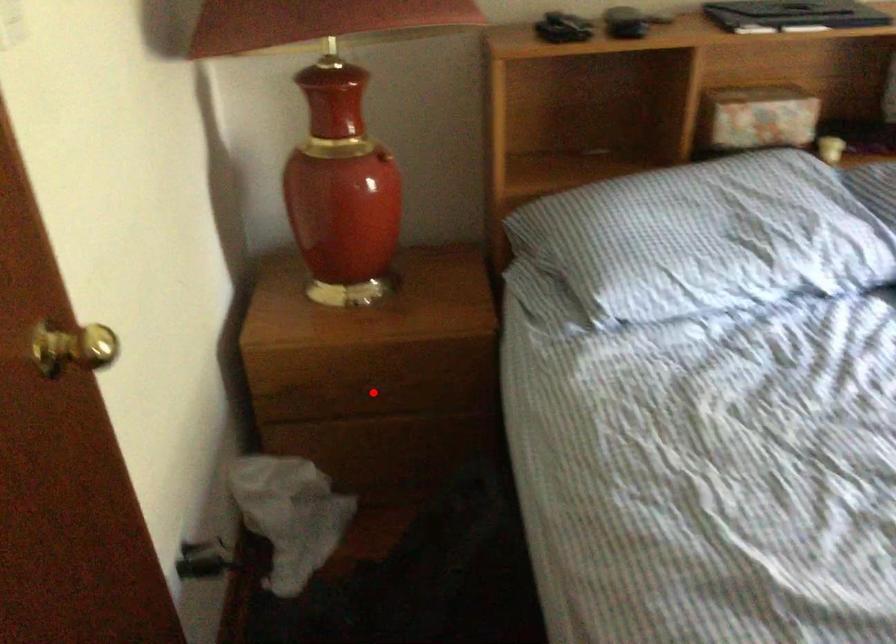
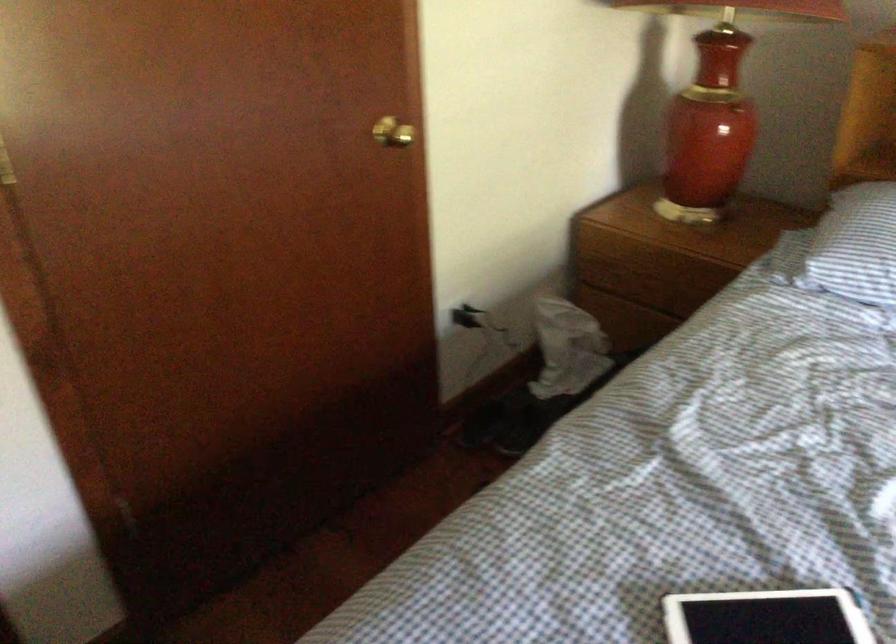
The point at the highlighted location is marked in the first image. Where is the corresponding point in the second image?

(650, 283)